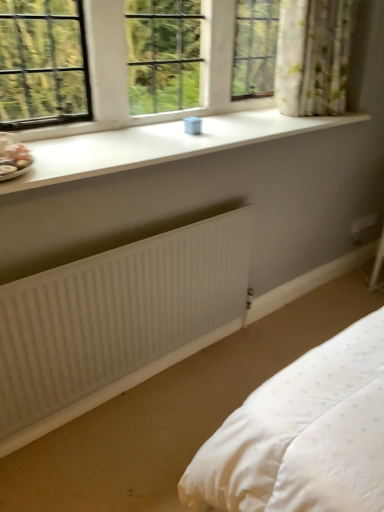
The image size is (384, 512). Find the location of `free spot to the right of white ribbed radiator at lower center`. free spot to the right of white ribbed radiator at lower center is located at coordinates (236, 365).